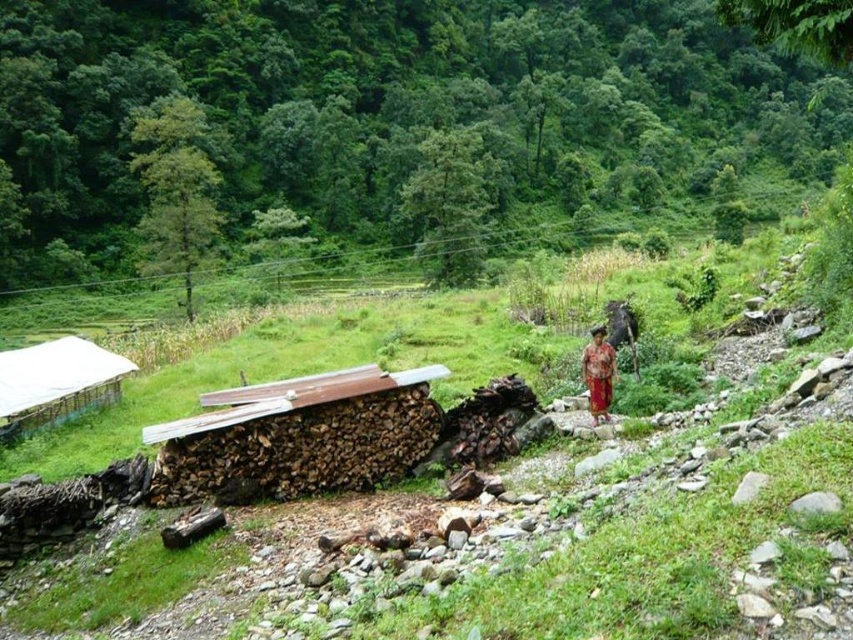
You are planning to hang a red fabric dress at center on a clothesline between two objects. The white plastic hut at lower left is nearby. Which object should you choose as the second support point if you want the clothesline to be higher than the dress?

The white plastic hut at lower left should be used as the second support point because it has a greater height compared to the red fabric dress at center, allowing the clothesline to be positioned higher.

You are hiking and come across this valley. You see a white plastic hut at lower left and a red fabric dress at center. Which object is positioned to the left of the other?

The white plastic hut at lower left is to the left of the red fabric dress at center.